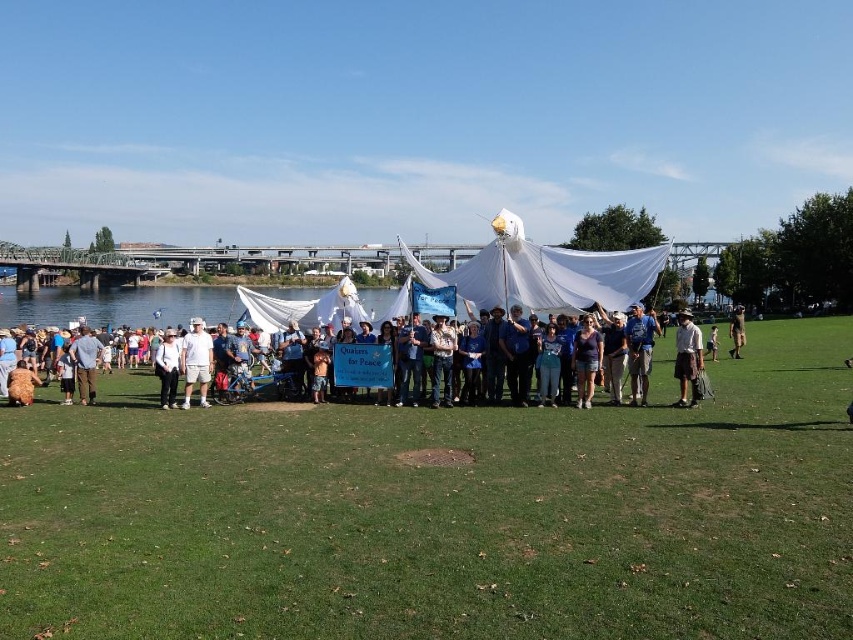
Question: Which point is farther to the camera?

Choices:
 (A) green grass at center
 (B) white cotton shorts at center

Answer: (B)

Question: Which point is closer to the camera taking this photo?

Choices:
 (A) (740, 333)
 (B) (711, 332)
 (C) (625, 321)

Answer: (C)

Question: Which point is farther to the camera?

Choices:
 (A) green grass at center
 (B) white cotton shirt at lower left
 (C) white cotton shorts at center
 (D) white cotton shirt at center

Answer: (D)

Question: Observing the image, what is the correct spatial positioning of blue fabric at center in reference to khaki fabric shorts at center?

Choices:
 (A) above
 (B) below

Answer: (B)

Question: Where is blue fabric at center located in relation to white cotton shirt at center in the image?

Choices:
 (A) right
 (B) left

Answer: (B)

Question: From the image, what is the correct spatial relationship of white cotton shirt at lower left in relation to white cotton shirt at center?

Choices:
 (A) below
 (B) above

Answer: (A)